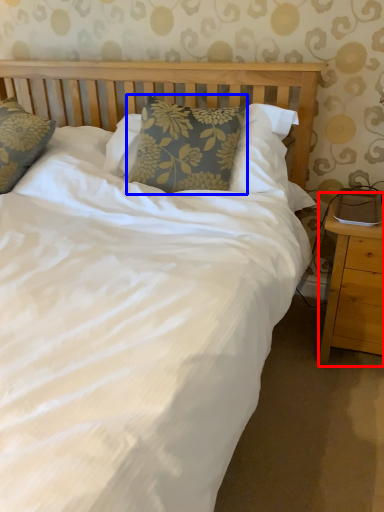
Question: Which object appears closest to the camera in this image, nightstand (highlighted by a red box) or pillow (highlighted by a blue box)?

Choices:
 (A) nightstand
 (B) pillow

Answer: (A)